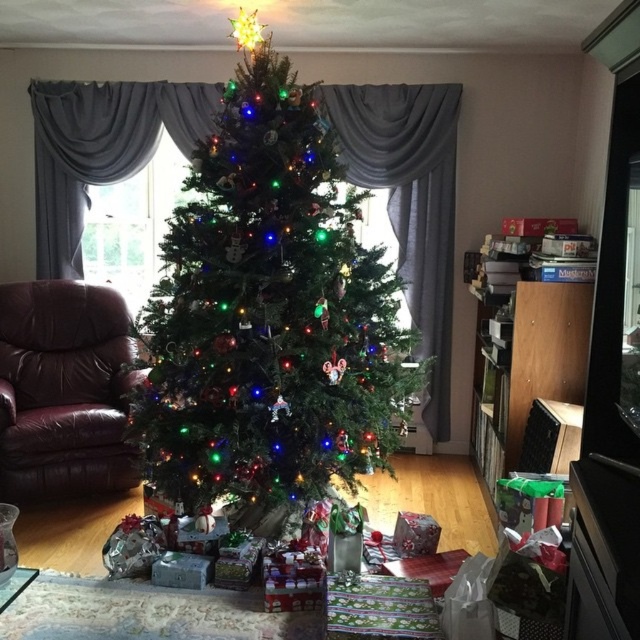
Question: Is green matte christmas tree at center bigger than leather armchair at left?

Choices:
 (A) yes
 (B) no

Answer: (A)

Question: Does green matte christmas tree at center have a greater width compared to leather armchair at left?

Choices:
 (A) no
 (B) yes

Answer: (B)

Question: Can you confirm if green matte christmas tree at center is bigger than leather armchair at left?

Choices:
 (A) no
 (B) yes

Answer: (B)

Question: Which object appears closest to the camera in this image?

Choices:
 (A) leather armchair at left
 (B) green matte christmas tree at center

Answer: (B)